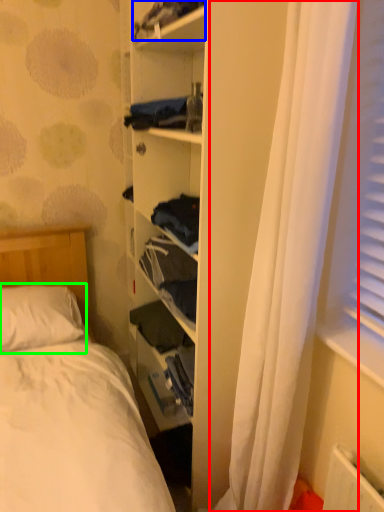
Question: Which is nearer to the curtain (highlighted by a red box)? clothing (highlighted by a blue box) or pillow (highlighted by a green box).

Choices:
 (A) clothing
 (B) pillow

Answer: (A)